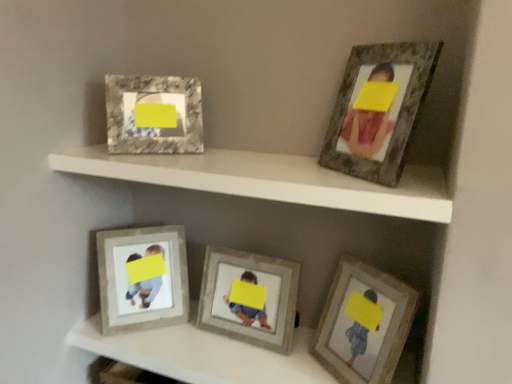
The height and width of the screenshot is (384, 512). Describe the element at coordinates (154, 114) in the screenshot. I see `marble-like frame at upper left, positioned as the 2th picture frame in left-to-right order` at that location.

This screenshot has height=384, width=512. Identify the location of wooden photo frame at lower right, which appears as the 2th picture frame when viewed from the right. (364, 324).

Image resolution: width=512 pixels, height=384 pixels. In order to click on matte gray frame at upper center in this screenshot , I will do `click(269, 180)`.

You are a GUI agent. You are given a task and a screenshot of the screen. Output one action in this format:
    pyautogui.click(x=<x>, y=<y>)
    Task: Click on the matte gray frame at center, the 3th picture frame positioned from the left
    
    Given the screenshot: What is the action you would take?
    pyautogui.click(x=249, y=308)

Can you confirm if rustic wood frame at upper right, the 1th picture frame viewed from the right, is positioned to the left of wooden textured frame at lower left, the 5th picture frame in the right-to-left sequence?

Incorrect, rustic wood frame at upper right, the 1th picture frame viewed from the right, is not on the left side of wooden textured frame at lower left, the 5th picture frame in the right-to-left sequence.

Which object is wider, rustic wood frame at upper right, the 1th picture frame viewed from the right, or wooden textured frame at lower left, the 5th picture frame in the right-to-left sequence?

rustic wood frame at upper right, the 1th picture frame viewed from the right, is wider.

Considering the sizes of objects rustic wood frame at upper right, the 1th picture frame viewed from the right, and wooden textured frame at lower left, the 5th picture frame in the right-to-left sequence, in the image provided, who is smaller, rustic wood frame at upper right, the 1th picture frame viewed from the right, or wooden textured frame at lower left, the 5th picture frame in the right-to-left sequence,?

rustic wood frame at upper right, the 1th picture frame viewed from the right, is smaller.

What's the angular difference between rustic wood frame at upper right, the 5th picture frame when ordered from left to right, and wooden textured frame at lower left, the 5th picture frame in the right-to-left sequence,'s facing directions?

rustic wood frame at upper right, the 5th picture frame when ordered from left to right, and wooden textured frame at lower left, the 5th picture frame in the right-to-left sequence, are facing 83.2 degrees away from each other.

Which of these two, matte gray frame at upper center or marble-like frame at upper left, arranged as the fourth picture frame when viewed from the right, is bigger?

Bigger between the two is matte gray frame at upper center.

Does matte gray frame at upper center appear on the right side of marble-like frame at upper left, positioned as the 2th picture frame in left-to-right order?

Yes.

Is matte gray frame at upper center not near marble-like frame at upper left, positioned as the 2th picture frame in left-to-right order?

matte gray frame at upper center is actually quite close to marble-like frame at upper left, positioned as the 2th picture frame in left-to-right order.

Is matte gray frame at upper center taller than marble-like frame at upper left, positioned as the 2th picture frame in left-to-right order?

No.

Is rustic wood frame at upper right, the 1th picture frame viewed from the right, to the left or to the right of wooden photo frame at lower right, which appears as the 2th picture frame when viewed from the right, in the image?

In the image, rustic wood frame at upper right, the 1th picture frame viewed from the right, appears on the right side of wooden photo frame at lower right, which appears as the 2th picture frame when viewed from the right.

How distant is rustic wood frame at upper right, the 1th picture frame viewed from the right, from wooden photo frame at lower right, which appears as the 2th picture frame when viewed from the right?

rustic wood frame at upper right, the 1th picture frame viewed from the right, and wooden photo frame at lower right, which appears as the 2th picture frame when viewed from the right, are 46.29 centimeters apart from each other.

What are the coordinates of `picture frame located on the right of wooden photo frame at lower right, which is the fourth picture frame from left to right` in the screenshot? It's located at (379, 109).

Which is in front, point (331, 127) or point (334, 341)?

The point (331, 127) is more forward.

Considering the sizes of objects matte gray frame at upper center and wooden photo frame at lower right, which appears as the 2th picture frame when viewed from the right, in the image provided, who is taller, matte gray frame at upper center or wooden photo frame at lower right, which appears as the 2th picture frame when viewed from the right,?

With more height is wooden photo frame at lower right, which appears as the 2th picture frame when viewed from the right.

Can we say matte gray frame at upper center lies outside wooden photo frame at lower right, which appears as the 2th picture frame when viewed from the right?

Yes, matte gray frame at upper center is outside of wooden photo frame at lower right, which appears as the 2th picture frame when viewed from the right.

The image size is (512, 384). What are the coordinates of `shelf on the left of wooden photo frame at lower right, which appears as the 2th picture frame when viewed from the right` in the screenshot? It's located at (269, 180).

From the image's perspective, is matte gray frame at upper center beneath wooden photo frame at lower right, which appears as the 2th picture frame when viewed from the right?

Actually, matte gray frame at upper center appears above wooden photo frame at lower right, which appears as the 2th picture frame when viewed from the right, in the image.

Does matte gray frame at center, the 3th picture frame positioned from the left, turn towards rustic wood frame at upper right, the 1th picture frame viewed from the right?

No, matte gray frame at center, the 3th picture frame positioned from the left, is not oriented towards rustic wood frame at upper right, the 1th picture frame viewed from the right.

From a real-world perspective, which is physically below, matte gray frame at center, arranged as the third picture frame when viewed from the right, or rustic wood frame at upper right, the 1th picture frame viewed from the right?

matte gray frame at center, arranged as the third picture frame when viewed from the right.

Can you confirm if matte gray frame at center, the 3th picture frame positioned from the left, is thinner than rustic wood frame at upper right, the 1th picture frame viewed from the right?

Incorrect, the width of matte gray frame at center, the 3th picture frame positioned from the left, is not less than that of rustic wood frame at upper right, the 1th picture frame viewed from the right.

Which is nearer, (276, 334) or (115, 79)?

Positioned in front is point (276, 334).

From the image's perspective, which object appears higher, matte gray frame at center, arranged as the third picture frame when viewed from the right, or marble-like frame at upper left, positioned as the 2th picture frame in left-to-right order?

marble-like frame at upper left, positioned as the 2th picture frame in left-to-right order, is shown above in the image.

Is matte gray frame at center, the 3th picture frame positioned from the left, oriented towards marble-like frame at upper left, arranged as the fourth picture frame when viewed from the right?

No, matte gray frame at center, the 3th picture frame positioned from the left, is not aimed at marble-like frame at upper left, arranged as the fourth picture frame when viewed from the right.

Considering the sizes of matte gray frame at center, arranged as the third picture frame when viewed from the right, and marble-like frame at upper left, positioned as the 2th picture frame in left-to-right order, in the image, is matte gray frame at center, arranged as the third picture frame when viewed from the right, bigger or smaller than marble-like frame at upper left, positioned as the 2th picture frame in left-to-right order,?

matte gray frame at center, arranged as the third picture frame when viewed from the right, is bigger than marble-like frame at upper left, positioned as the 2th picture frame in left-to-right order.

Considering the relative sizes of rustic wood frame at upper right, the 1th picture frame viewed from the right, and matte gray frame at center, the 3th picture frame positioned from the left, in the image provided, is rustic wood frame at upper right, the 1th picture frame viewed from the right, wider than matte gray frame at center, the 3th picture frame positioned from the left,?

No.

From a real-world perspective, which is physically below, rustic wood frame at upper right, the 5th picture frame when ordered from left to right, or matte gray frame at center, the 3th picture frame positioned from the left?

In real-world perspective, matte gray frame at center, the 3th picture frame positioned from the left, is lower.

Is rustic wood frame at upper right, the 5th picture frame when ordered from left to right, inside the boundaries of matte gray frame at center, arranged as the third picture frame when viewed from the right, or outside?

rustic wood frame at upper right, the 5th picture frame when ordered from left to right, is not inside matte gray frame at center, arranged as the third picture frame when viewed from the right, it's outside.

Identify the location of the 2nd picture frame directly beneath the rustic wood frame at upper right, the 1th picture frame viewed from the right (from a real-world perspective). The height and width of the screenshot is (384, 512). (153, 278).

In the image, there is a marble-like frame at upper left, positioned as the 2th picture frame in left-to-right order. Where is `shelf below it (from the image's perspective)`? The image size is (512, 384). shelf below it (from the image's perspective) is located at coordinates (269, 180).

From the image, which object appears to be farther from rustic wood frame at upper right, the 5th picture frame when ordered from left to right, wooden photo frame at lower right, which appears as the 2th picture frame when viewed from the right, or matte gray frame at upper center?

wooden photo frame at lower right, which appears as the 2th picture frame when viewed from the right, is further to rustic wood frame at upper right, the 5th picture frame when ordered from left to right.

Looking at the image, which one is located further to wooden textured frame at lower left, arranged as the first picture frame when viewed from the left, matte gray frame at upper center or matte gray frame at center, the 3th picture frame positioned from the left?

Based on the image, matte gray frame at upper center appears to be further to wooden textured frame at lower left, arranged as the first picture frame when viewed from the left.

When comparing their distances from wooden photo frame at lower right, which appears as the 2th picture frame when viewed from the right, does matte gray frame at center, the 3th picture frame positioned from the left, or rustic wood frame at upper right, the 5th picture frame when ordered from left to right, seem further?

Based on the image, rustic wood frame at upper right, the 5th picture frame when ordered from left to right, appears to be further to wooden photo frame at lower right, which appears as the 2th picture frame when viewed from the right.

Considering their positions, is marble-like frame at upper left, positioned as the 2th picture frame in left-to-right order, positioned closer to wooden textured frame at lower left, arranged as the first picture frame when viewed from the left, than matte gray frame at center, arranged as the third picture frame when viewed from the right?

matte gray frame at center, arranged as the third picture frame when viewed from the right, is closer to wooden textured frame at lower left, arranged as the first picture frame when viewed from the left.

Estimate the real-world distances between objects in this image. Which object is further from marble-like frame at upper left, arranged as the fourth picture frame when viewed from the right, matte gray frame at upper center or rustic wood frame at upper right, the 1th picture frame viewed from the right?

The object further to marble-like frame at upper left, arranged as the fourth picture frame when viewed from the right, is rustic wood frame at upper right, the 1th picture frame viewed from the right.

Which object lies further to the anchor point matte gray frame at upper center, matte gray frame at center, arranged as the third picture frame when viewed from the right, or wooden textured frame at lower left, arranged as the first picture frame when viewed from the left?

Based on the image, wooden textured frame at lower left, arranged as the first picture frame when viewed from the left, appears to be further to matte gray frame at upper center.

Which object lies nearer to the anchor point marble-like frame at upper left, positioned as the 2th picture frame in left-to-right order, wooden photo frame at lower right, which appears as the 2th picture frame when viewed from the right, or matte gray frame at upper center?

matte gray frame at upper center is closer to marble-like frame at upper left, positioned as the 2th picture frame in left-to-right order.

Looking at the image, which one is located closer to rustic wood frame at upper right, the 5th picture frame when ordered from left to right, matte gray frame at upper center or wooden photo frame at lower right, which appears as the 2th picture frame when viewed from the right?

matte gray frame at upper center is closer to rustic wood frame at upper right, the 5th picture frame when ordered from left to right.

In order to click on shelf between wooden textured frame at lower left, the 5th picture frame in the right-to-left sequence, and wooden photo frame at lower right, which is the fourth picture frame from left to right, in the horizontal direction in this screenshot , I will do `click(269, 180)`.

Where is `shelf between rustic wood frame at upper right, the 1th picture frame viewed from the right, and matte gray frame at center, arranged as the third picture frame when viewed from the right, vertically`? shelf between rustic wood frame at upper right, the 1th picture frame viewed from the right, and matte gray frame at center, arranged as the third picture frame when viewed from the right, vertically is located at coordinates tap(269, 180).

This screenshot has width=512, height=384. What are the coordinates of `shelf between marble-like frame at upper left, positioned as the 2th picture frame in left-to-right order, and matte gray frame at center, arranged as the third picture frame when viewed from the right, in the up-down direction` in the screenshot? It's located at (269, 180).

The width and height of the screenshot is (512, 384). Identify the location of shelf that lies between rustic wood frame at upper right, the 1th picture frame viewed from the right, and wooden photo frame at lower right, which appears as the 2th picture frame when viewed from the right, from top to bottom. (269, 180).